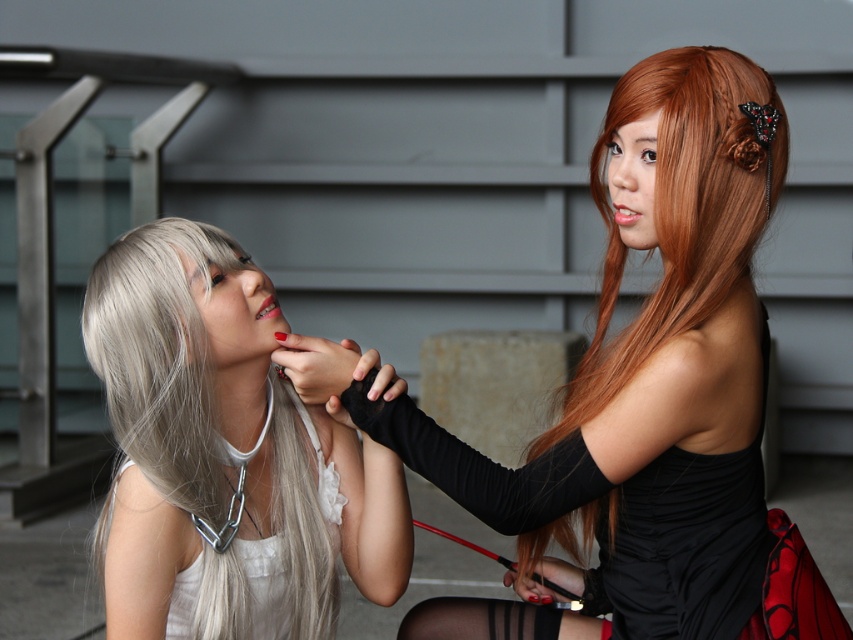
Who is more forward, (329, 506) or (256, 312)?

Positioned in front is point (256, 312).

From the picture: Between white satin dress at left and matte red lipstick at center, which one is positioned lower?

white satin dress at left is lower down.

Image resolution: width=853 pixels, height=640 pixels. What are the coordinates of `white satin dress at left` in the screenshot? It's located at (270, 556).

Does matte silver chain at center lie behind white satin dress at left?

No, it is not.

Is matte silver chain at center taller than white satin dress at left?

Yes, matte silver chain at center is taller than white satin dress at left.

Where is `matte silver chain at center`? This screenshot has width=853, height=640. matte silver chain at center is located at coordinates (224, 452).

Find the location of `matte silver chain at center`. matte silver chain at center is located at coordinates (224, 452).

Describe the element at coordinates (682, 209) in the screenshot. I see `shiny orange hair at right` at that location.

Is point (595, 198) less distant than point (502, 600)?

Yes, point (595, 198) is closer to viewer.

Which is in front, point (769, 100) or point (445, 634)?

Point (769, 100)

Identify the location of shiny orange hair at right. This screenshot has width=853, height=640. (682, 209).